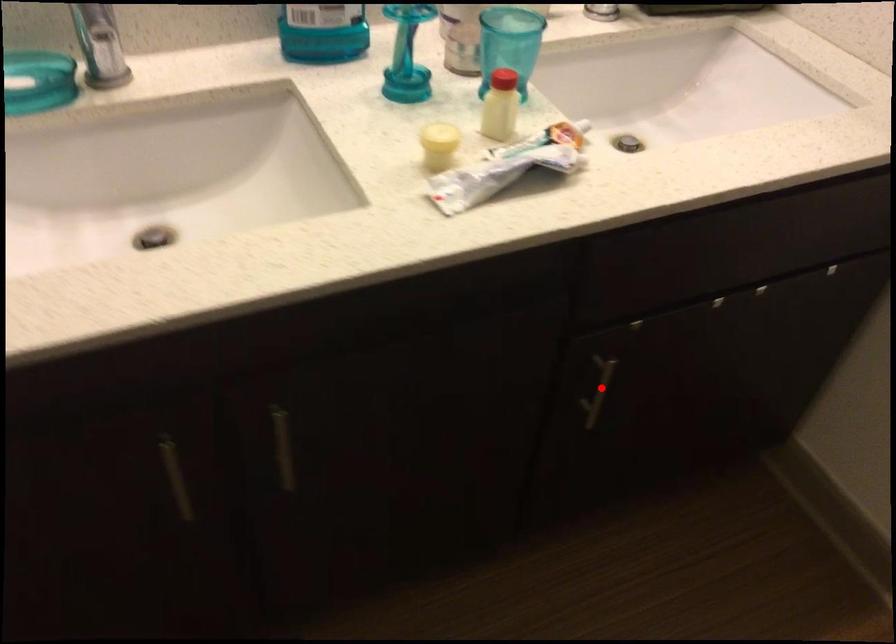
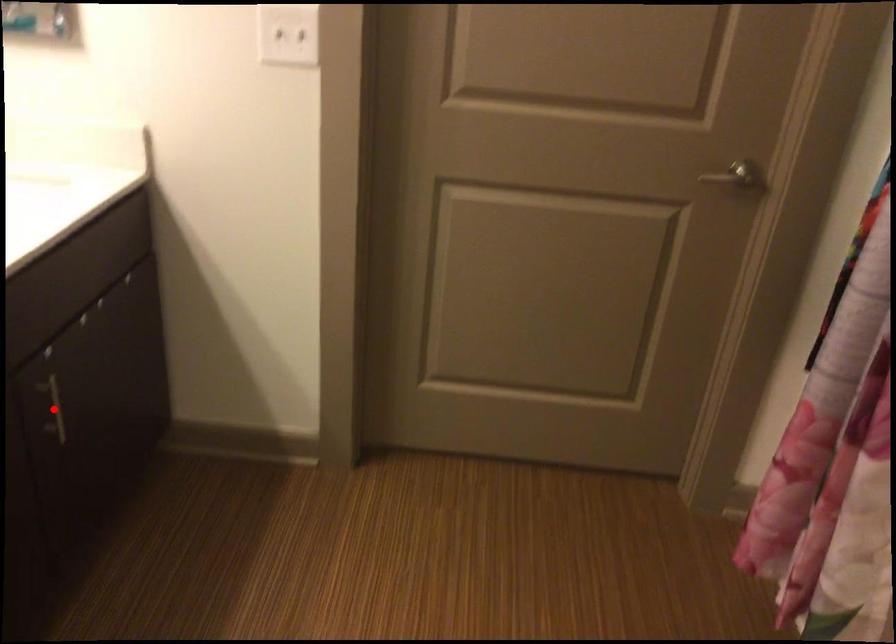
Based on the photo, I am providing you with two images of the same scene from different viewpoints. A red point is marked on the first image and another point is marked on the second image. Are the points marked in image1 and image2 representing the same 3D position?

Yes